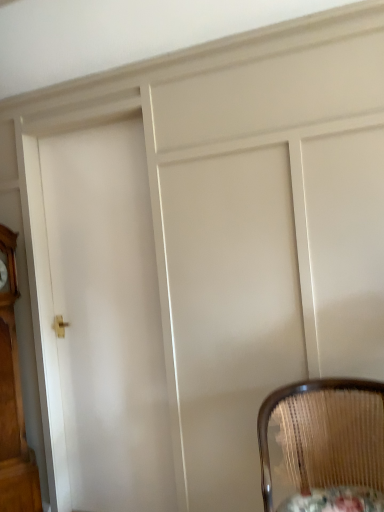
Question: Does point (349, 499) appear closer or farther from the camera than point (8, 375)?

Choices:
 (A) closer
 (B) farther

Answer: (A)

Question: Choose the correct answer: Is wooden textured round table at lower right inside wooden grandfather clock at left or outside it?

Choices:
 (A) outside
 (B) inside

Answer: (A)

Question: Considering the real-world distances, which object is farthest from the white glossy door at center?

Choices:
 (A) woven wood chair at lower right
 (B) wooden grandfather clock at left
 (C) wooden textured round table at lower right

Answer: (C)

Question: Which object is the farthest from the woven wood chair at lower right?

Choices:
 (A) wooden textured round table at lower right
 (B) wooden grandfather clock at left
 (C) white glossy door at center

Answer: (B)